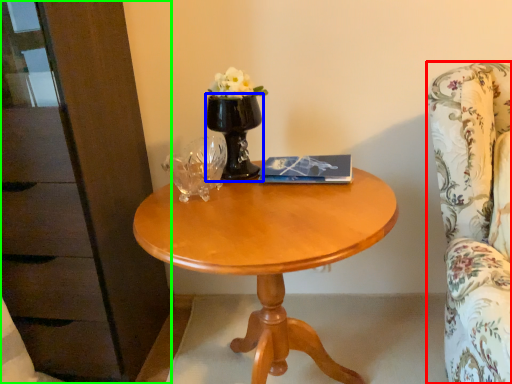
Question: Which object is the farthest from chair (highlighted by a red box)? Choose among these: vase (highlighted by a blue box) or dresser (highlighted by a green box).

Choices:
 (A) vase
 (B) dresser

Answer: (B)